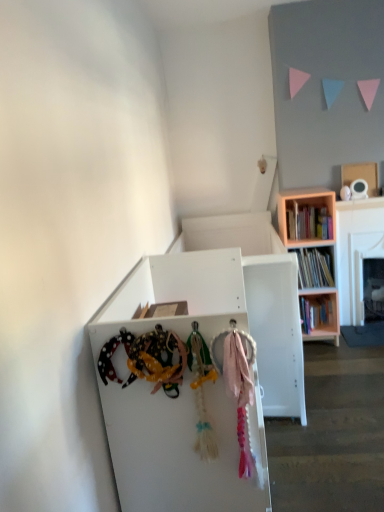
Question: Is white matte cabinet at center looking in the opposite direction of wooden bookshelf at right?

Choices:
 (A) no
 (B) yes

Answer: (A)

Question: Are white matte cabinet at center and wooden bookshelf at right making contact?

Choices:
 (A) no
 (B) yes

Answer: (A)

Question: From a real-world perspective, is white matte cabinet at center over wooden bookshelf at right?

Choices:
 (A) yes
 (B) no

Answer: (B)

Question: Is white matte cabinet at center at the right side of wooden bookshelf at right?

Choices:
 (A) yes
 (B) no

Answer: (B)

Question: From the image's perspective, is white matte cabinet at center below wooden bookshelf at right?

Choices:
 (A) no
 (B) yes

Answer: (B)

Question: Considering the relative sizes of white matte cabinet at center and wooden bookshelf at right in the image provided, is white matte cabinet at center bigger than wooden bookshelf at right?

Choices:
 (A) no
 (B) yes

Answer: (B)

Question: Could you tell me if wooden bookshelf at right is turned towards white matte cabinet at center?

Choices:
 (A) yes
 (B) no

Answer: (A)

Question: Is wooden bookshelf at right positioned behind white matte cabinet at center?

Choices:
 (A) no
 (B) yes

Answer: (B)

Question: Is wooden bookshelf at right to the left of white matte cabinet at center from the viewer's perspective?

Choices:
 (A) yes
 (B) no

Answer: (B)

Question: Could white matte cabinet at center be considered to be inside wooden bookshelf at right?

Choices:
 (A) yes
 (B) no

Answer: (B)

Question: Is wooden bookshelf at right not near white matte cabinet at center?

Choices:
 (A) no
 (B) yes

Answer: (B)

Question: Does wooden bookshelf at right have a smaller size compared to white matte cabinet at center?

Choices:
 (A) yes
 (B) no

Answer: (A)

Question: Is cardboard box at upper right closer to camera compared to pink fabric at center?

Choices:
 (A) no
 (B) yes

Answer: (A)